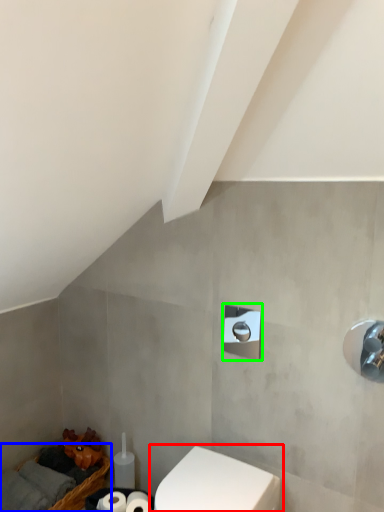
Question: Based on their relative distances, which object is farther from toilet (highlighted by a red box)? Choose from basket (highlighted by a blue box) and shower (highlighted by a green box).

Choices:
 (A) basket
 (B) shower

Answer: (A)